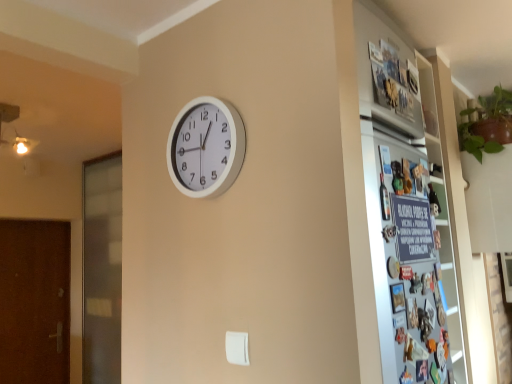
Question: Does point (201, 178) appear closer or farther from the camera than point (7, 311)?

Choices:
 (A) farther
 (B) closer

Answer: (B)

Question: Looking at the image, does white plastic wall clock at center seem bigger or smaller compared to brown textured door at left, the 1th screen door when ordered from left to right?

Choices:
 (A) small
 (B) big

Answer: (A)

Question: Estimate the real-world distances between objects in this image. Which object is closer to the metallic silver fridge at right?

Choices:
 (A) white plastic wall clock at center
 (B) brown textured door at left, the 2th screen door in the right-to-left sequence
 (C) transparent glass screen door at left, positioned as the 1th screen door in right-to-left order

Answer: (A)

Question: Which is nearer to the white plastic wall clock at center?

Choices:
 (A) transparent glass screen door at left, positioned as the 1th screen door in right-to-left order
 (B) brown textured door at left, the 1th screen door when ordered from left to right
 (C) metallic silver fridge at right

Answer: (C)